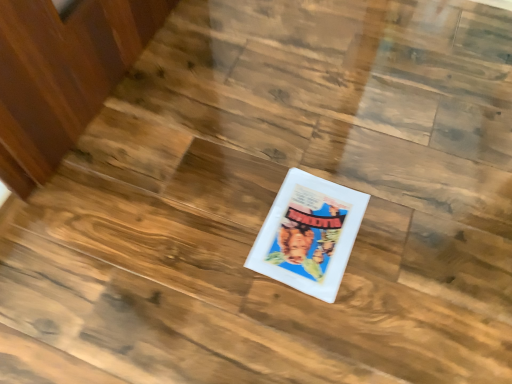
This screenshot has width=512, height=384. Find the location of `free space to the back side of white glossy book at center`. free space to the back side of white glossy book at center is located at coordinates (304, 147).